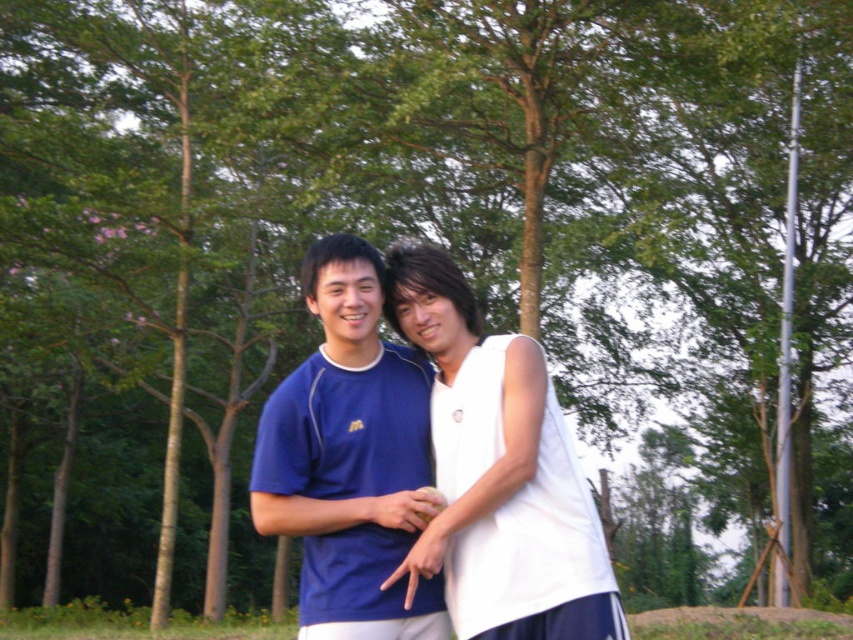
Is white matte tank top at center below matte blue shirt at center?

Yes.

Describe the element at coordinates (498, 474) in the screenshot. The width and height of the screenshot is (853, 640). I see `white matte tank top at center` at that location.

Find the location of a particular element. Image resolution: width=853 pixels, height=640 pixels. white matte tank top at center is located at coordinates (498, 474).

I want to click on white matte tank top at center, so click(498, 474).